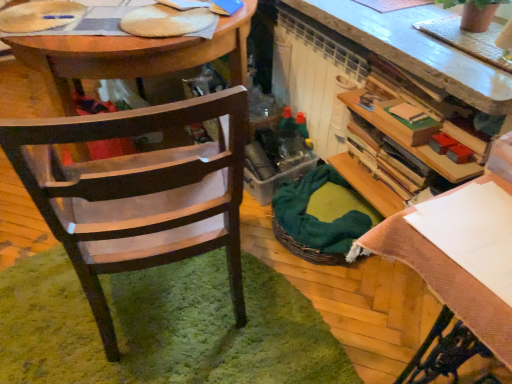
What do you see at coordinates (475, 12) in the screenshot? The image size is (512, 384). I see `terracotta textured pot at upper right` at bounding box center [475, 12].

Find the location of `terracotta textured pot at upper right`. terracotta textured pot at upper right is located at coordinates click(x=475, y=12).

What do you see at coordinates (130, 56) in the screenshot? This screenshot has height=384, width=512. I see `wooden desk at center` at bounding box center [130, 56].

You are a GUI agent. You are given a task and a screenshot of the screen. Output one action in this format:
    pyautogui.click(x=<x>, y=<y>)
    Task: Click on the green woven picnic basket at center
    
    Given the screenshot: What is the action you would take?
    pyautogui.click(x=321, y=217)

Is point (277, 239) farther from viewer compared to point (160, 128)?

No, (277, 239) is in front of (160, 128).

Would you say green woven picnic basket at center is outside wooden chair at left?

Yes, green woven picnic basket at center is located beyond the bounds of wooden chair at left.

From the picture: Measure the distance between green woven picnic basket at center and wooden chair at left.

green woven picnic basket at center and wooden chair at left are 23.81 inches apart.

Based on their sizes in the image, would you say green woven picnic basket at center is bigger or smaller than wooden chair at left?

green woven picnic basket at center is smaller than wooden chair at left.

Which of these two, wooden desk at center or green woven picnic basket at center, is wider?

Wider between the two is wooden desk at center.

Can you see wooden desk at center touching green woven picnic basket at center?

wooden desk at center and green woven picnic basket at center are clearly separated.

From the image's perspective, who appears lower, wooden desk at center or green woven picnic basket at center?

green woven picnic basket at center is shown below in the image.

Is wooden desk at center further to camera compared to green woven picnic basket at center?

No, wooden desk at center is closer to the viewer.

Considering the sizes of white paper at upper right and terracotta textured pot at upper right in the image, is white paper at upper right taller or shorter than terracotta textured pot at upper right?

Considering their sizes, white paper at upper right has more height than terracotta textured pot at upper right.

How different are the orientations of white paper at upper right and terracotta textured pot at upper right in degrees?

2.34 degrees separate the facing orientations of white paper at upper right and terracotta textured pot at upper right.

From the image's perspective, which one is positioned lower, white paper at upper right or terracotta textured pot at upper right?

white paper at upper right appears lower in the image.

Which of these two, white paper at upper right or terracotta textured pot at upper right, is smaller?

With smaller size is terracotta textured pot at upper right.

From the image's perspective, is wooden chair at left located above or below terracotta textured pot at upper right?

Clearly, from the image's perspective, wooden chair at left is below terracotta textured pot at upper right.

Which of these two, wooden chair at left or terracotta textured pot at upper right, is thinner?

With smaller width is terracotta textured pot at upper right.

The image size is (512, 384). Find the location of `houseplant above the wooden chair at left (from the image's perspective)`. houseplant above the wooden chair at left (from the image's perspective) is located at coordinates (475, 12).

Which of these two, wooden chair at left or terracotta textured pot at upper right, is smaller?

With smaller size is terracotta textured pot at upper right.

Looking at this image, can wooden desk at center be found inside green woven picnic basket at center?

No, wooden desk at center is not surrounded by green woven picnic basket at center.

Is the surface of green woven picnic basket at center in direct contact with wooden desk at center?

green woven picnic basket at center is not next to wooden desk at center, and they're not touching.

In terms of height, does green woven picnic basket at center look taller or shorter compared to wooden desk at center?

Considering their sizes, green woven picnic basket at center has less height than wooden desk at center.

In terms of width, does terracotta textured pot at upper right look wider or thinner when compared to green woven picnic basket at center?

Clearly, terracotta textured pot at upper right has less width compared to green woven picnic basket at center.

Is terracotta textured pot at upper right at the left side of green woven picnic basket at center?

No, terracotta textured pot at upper right is not to the left of green woven picnic basket at center.

Consider the image. Is terracotta textured pot at upper right oriented away from green woven picnic basket at center?

That's not correct — terracotta textured pot at upper right is not looking away from green woven picnic basket at center.

Locate an element on the screen. The height and width of the screenshot is (384, 512). desk above the wooden chair at left (from the image's perspective) is located at coordinates (130, 56).

Is wooden desk at center positioned before wooden chair at left?

No, wooden desk at center is further to the viewer.

Considering the sizes of objects wooden desk at center and wooden chair at left in the image provided, who is smaller, wooden desk at center or wooden chair at left?

wooden chair at left is smaller.

From the image's perspective, is wooden desk at center located above wooden chair at left?

Yes.

Identify the location of picnic basket located behind the wooden chair at left. (321, 217).

Find the location of a particular element. The height and width of the screenshot is (384, 512). desk that appears in front of the green woven picnic basket at center is located at coordinates (130, 56).

Estimate the real-world distances between objects in this image. Which object is closer to terracotta textured pot at upper right, wooden chair at left or wooden desk at center?

Among the two, wooden chair at left is located nearer to terracotta textured pot at upper right.

Which object lies nearer to the anchor point wooden chair at left, terracotta textured pot at upper right or wooden desk at center?

wooden desk at center is closer to wooden chair at left.

Looking at this image, based on their spatial positions, is wooden desk at center or white paper at upper right further from green woven picnic basket at center?

Among the two, white paper at upper right is located further to green woven picnic basket at center.

Which object lies further to the anchor point wooden desk at center, green woven picnic basket at center or white paper at upper right?

The object further to wooden desk at center is white paper at upper right.

Based on their spatial positions, is wooden chair at left or green woven picnic basket at center closer to white paper at upper right?

wooden chair at left is closer to white paper at upper right.

Which object lies nearer to the anchor point terracotta textured pot at upper right, white paper at upper right or wooden desk at center?

Based on the image, white paper at upper right appears to be nearer to terracotta textured pot at upper right.

Considering their positions, is wooden desk at center positioned further to wooden chair at left than terracotta textured pot at upper right?

terracotta textured pot at upper right.

Looking at the image, which one is located further to white paper at upper right, wooden chair at left or terracotta textured pot at upper right?

terracotta textured pot at upper right is further to white paper at upper right.

This screenshot has width=512, height=384. Identify the location of picnic basket situated between wooden chair at left and terracotta textured pot at upper right from left to right. pyautogui.click(x=321, y=217).

Where is `houseplant positioned between white paper at upper right and green woven picnic basket at center from near to far`? houseplant positioned between white paper at upper right and green woven picnic basket at center from near to far is located at coordinates (475, 12).

You are a GUI agent. You are given a task and a screenshot of the screen. Output one action in this format:
    pyautogui.click(x=<x>, y=<y>)
    Task: Click on the table between wooden chair at left and terracotta textured pot at upper right from left to right
    
    Given the screenshot: What is the action you would take?
    pyautogui.click(x=446, y=282)

Locate an element on the screen. This screenshot has width=512, height=384. chair situated between wooden desk at center and green woven picnic basket at center from left to right is located at coordinates (138, 193).